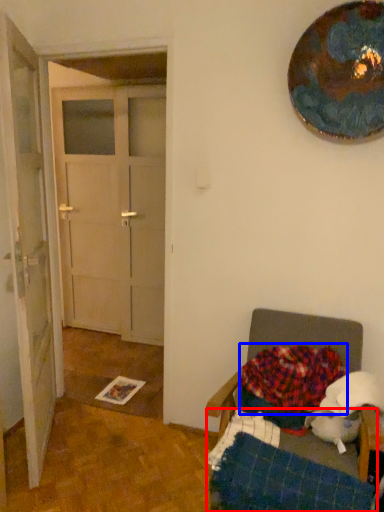
Question: Which of the following is the closest to the observer, bed frame (highlighted by a red box) or blanket (highlighted by a blue box)?

Choices:
 (A) bed frame
 (B) blanket

Answer: (A)